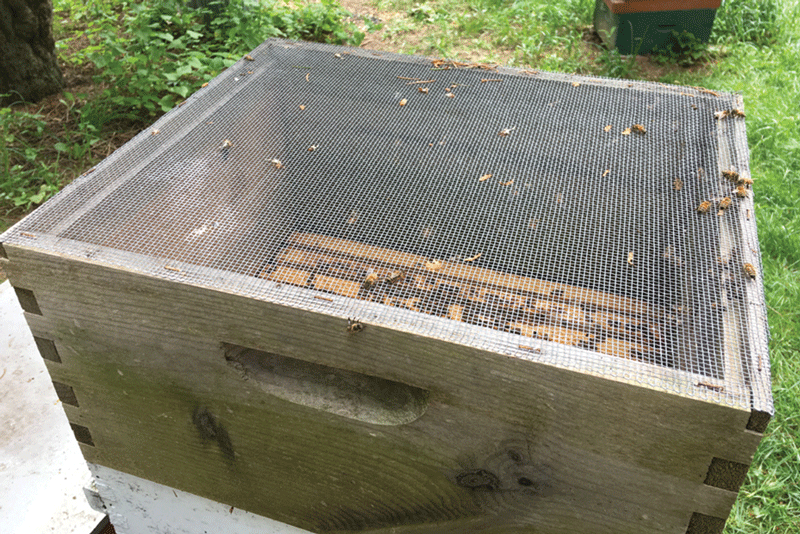
You are a GUI agent. You are given a task and a screenshot of the screen. Output one action in this format:
    pyautogui.click(x=<x>, y=<y>)
    Task: Click on the wood box side
    
    Given the screenshot: What is the action you would take?
    pyautogui.click(x=569, y=475)